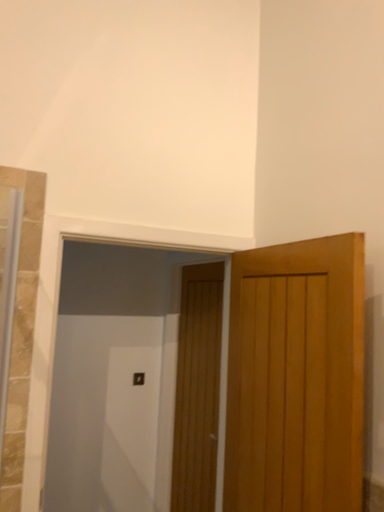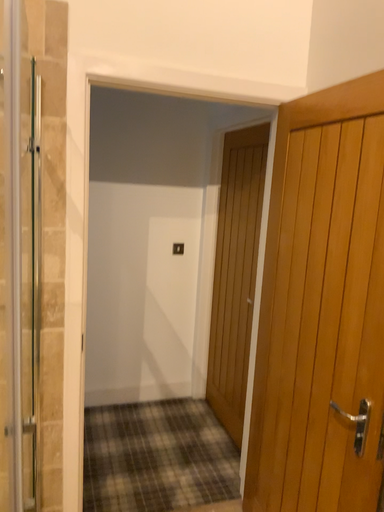
Question: How did the camera likely rotate when shooting the video?

Choices:
 (A) rotated upward
 (B) rotated downward

Answer: (B)